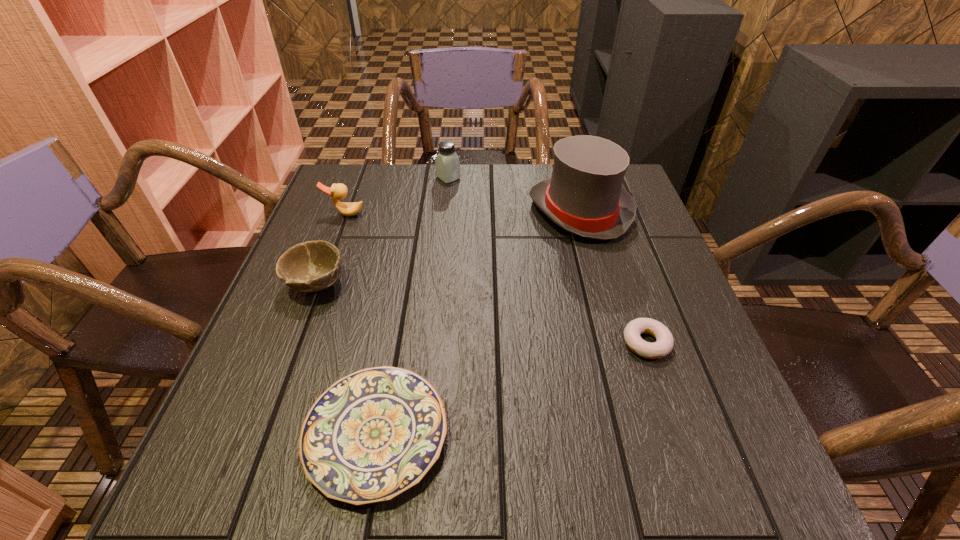
Image resolution: width=960 pixels, height=540 pixels. I want to click on free spot located on the front of the saltshaker, so click(x=439, y=280).

Find the location of a particular element. Image resolution: width=960 pixels, height=540 pixels. free region located on the beak of the duck is located at coordinates (312, 305).

Where is `vacant area situated on the front of the third shortest object`? vacant area situated on the front of the third shortest object is located at coordinates 294,345.

You are a GUI agent. You are given a task and a screenshot of the screen. Output one action in this format:
    pyautogui.click(x=<x>, y=<y>)
    Task: Click on the free space located on the front of the doughnut
    
    Given the screenshot: What is the action you would take?
    pyautogui.click(x=699, y=499)

This screenshot has height=540, width=960. Find the location of `vacant region located 0.090m on the back of the shortest object`. vacant region located 0.090m on the back of the shortest object is located at coordinates (395, 335).

This screenshot has width=960, height=540. What are the coordinates of `dress hat that is at the far edge` in the screenshot? It's located at (585, 196).

At what (x,y) coordinates should I click in order to perform the action: click on saltshaker at the far edge. Please return your answer as a coordinate pair (x, y). Looking at the image, I should click on (447, 163).

Where is `duck that is at the far edge`? The image size is (960, 540). duck that is at the far edge is located at coordinates (338, 191).

What are the coordinates of `object that is positioned at the near edge` in the screenshot? It's located at (372, 435).

At what (x,y) coordinates should I click in order to perform the action: click on duck that is positioned at the left edge. Please return your answer as a coordinate pair (x, y). The width and height of the screenshot is (960, 540). Looking at the image, I should click on (338, 191).